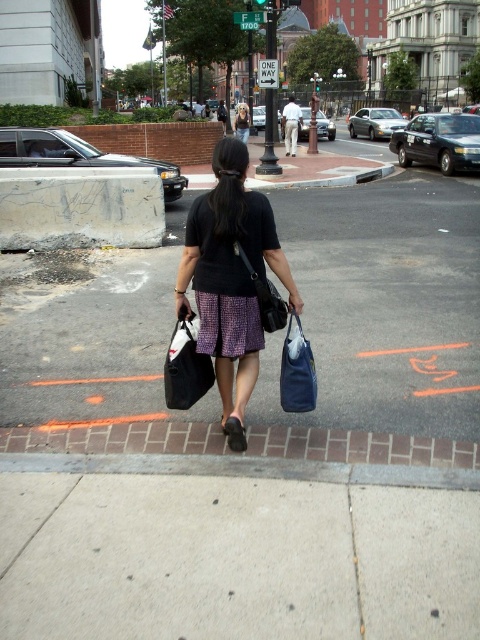
Is gray concrete sidewalk at lower center behind matte black bag at center?

No.

From the picture: Which is above, gray concrete sidewalk at lower center or matte black bag at center?

matte black bag at center is higher up.

Where is `gray concrete sidewalk at lower center`? Image resolution: width=480 pixels, height=640 pixels. gray concrete sidewalk at lower center is located at coordinates (233, 557).

Which is below, gray concrete sidewalk at lower center or matte blue fabric bag at lower center?

Positioned lower is gray concrete sidewalk at lower center.

Who is more forward, (22,582) or (307,372)?

Positioned in front is point (22,582).

What do you see at coordinates (233, 557) in the screenshot? I see `gray concrete sidewalk at lower center` at bounding box center [233, 557].

Identify the location of gray concrete sidewalk at lower center. (233, 557).

Is leather textured handbag at center smaller than matte black skirt at center?

Yes, leather textured handbag at center is smaller than matte black skirt at center.

How far apart are leather textured handbag at center and matte black skirt at center?

leather textured handbag at center and matte black skirt at center are 66.27 feet apart.

Which is in front, point (271, 308) or point (249, 125)?

Point (271, 308)

Identify the location of leather textured handbag at center. (264, 296).